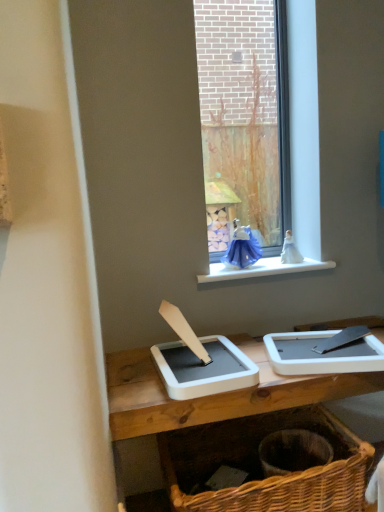
Question: From a real-world perspective, is woven brown basket at lower right positioned under blue glass window at center based on gravity?

Choices:
 (A) no
 (B) yes

Answer: (B)

Question: Considering the relative positions of woven brown basket at lower right and blue glass window at center in the image provided, is woven brown basket at lower right to the left of blue glass window at center from the viewer's perspective?

Choices:
 (A) yes
 (B) no

Answer: (A)

Question: Is woven brown basket at lower right positioned far away from blue glass window at center?

Choices:
 (A) no
 (B) yes

Answer: (A)

Question: Is woven brown basket at lower right at the right side of blue glass window at center?

Choices:
 (A) no
 (B) yes

Answer: (A)

Question: Is woven brown basket at lower right thinner than blue glass window at center?

Choices:
 (A) no
 (B) yes

Answer: (A)

Question: In terms of height, does blue glass window at center look taller or shorter compared to white plastic window sill at upper center?

Choices:
 (A) tall
 (B) short

Answer: (A)

Question: Is blue glass window at center bigger or smaller than white plastic window sill at upper center?

Choices:
 (A) small
 (B) big

Answer: (B)

Question: Does point (218, 202) appear closer or farther from the camera than point (243, 276)?

Choices:
 (A) farther
 (B) closer

Answer: (A)

Question: From a real-world perspective, is blue glass window at center physically located above or below white plastic window sill at upper center?

Choices:
 (A) above
 (B) below

Answer: (A)

Question: Does point (180, 510) appear closer or farther from the camera than point (304, 139)?

Choices:
 (A) farther
 (B) closer

Answer: (B)

Question: Considering the positions of woven brown basket at lower right and blue glass window at center in the image, is woven brown basket at lower right bigger or smaller than blue glass window at center?

Choices:
 (A) small
 (B) big

Answer: (B)

Question: Considering the positions of woven brown basket at lower right and blue glass window at center in the image, is woven brown basket at lower right taller or shorter than blue glass window at center?

Choices:
 (A) tall
 (B) short

Answer: (B)

Question: In the image, is woven brown basket at lower right on the left side or the right side of blue glass window at center?

Choices:
 (A) right
 (B) left

Answer: (B)

Question: From a real-world perspective, is blue glass window at center above or below woven brown basket at lower right?

Choices:
 (A) below
 (B) above

Answer: (B)

Question: From the image's perspective, is blue glass window at center located above or below woven brown basket at lower right?

Choices:
 (A) above
 (B) below

Answer: (A)